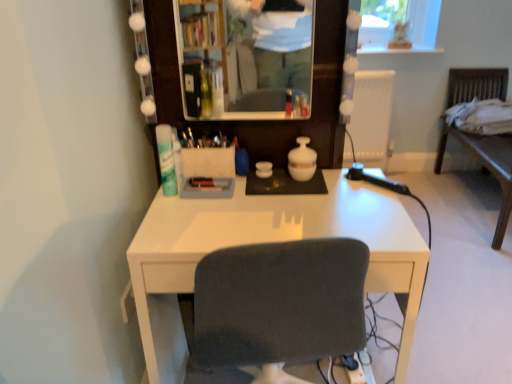
Question: Does wooden chair at right contain white glossy desk at center?

Choices:
 (A) yes
 (B) no

Answer: (B)

Question: Is wooden chair at right bigger than white glossy desk at center?

Choices:
 (A) no
 (B) yes

Answer: (B)

Question: Is wooden chair at right turned away from white glossy desk at center?

Choices:
 (A) yes
 (B) no

Answer: (B)

Question: From a real-world perspective, does wooden chair at right stand above white glossy desk at center?

Choices:
 (A) yes
 (B) no

Answer: (A)

Question: Is wooden chair at right not inside white glossy desk at center?

Choices:
 (A) no
 (B) yes

Answer: (B)

Question: Is wooden chair at right to the right of white glossy desk at center from the viewer's perspective?

Choices:
 (A) yes
 (B) no

Answer: (A)

Question: Can you confirm if wooden chair at right is shorter than white matte deodorant at left?

Choices:
 (A) yes
 (B) no

Answer: (B)

Question: From the image's perspective, is wooden chair at right below white matte deodorant at left?

Choices:
 (A) yes
 (B) no

Answer: (B)

Question: Is wooden chair at right thinner than white matte deodorant at left?

Choices:
 (A) no
 (B) yes

Answer: (A)

Question: Is wooden chair at right next to white matte deodorant at left and touching it?

Choices:
 (A) yes
 (B) no

Answer: (B)

Question: Considering the relative positions of wooden chair at right and white matte deodorant at left in the image provided, is wooden chair at right behind white matte deodorant at left?

Choices:
 (A) no
 (B) yes

Answer: (B)

Question: Is wooden chair at right wider than white matte deodorant at left?

Choices:
 (A) yes
 (B) no

Answer: (A)

Question: Does wooden chair at right turn towards white plastic radiator at upper right?

Choices:
 (A) yes
 (B) no

Answer: (A)